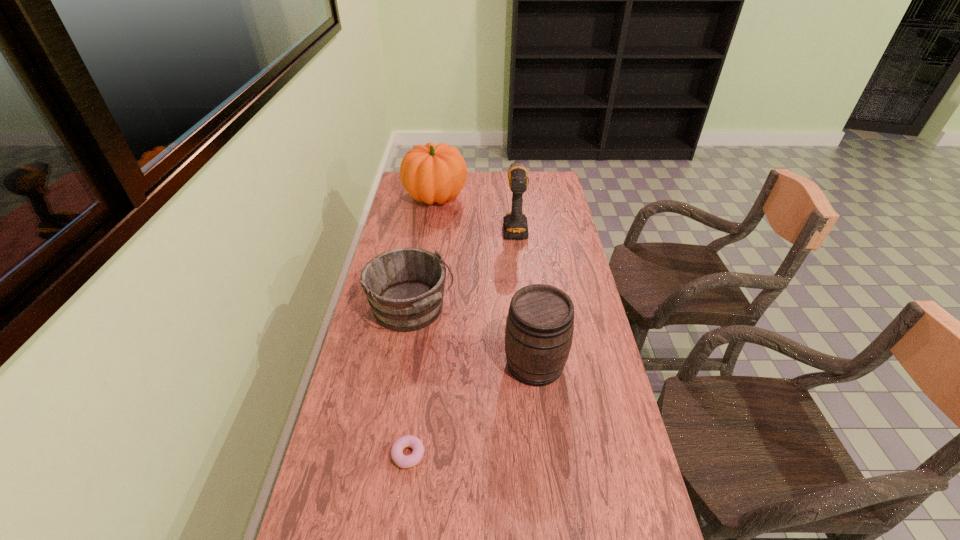
Find the location of a particular element. The width and height of the screenshot is (960, 540). drill is located at coordinates (515, 225).

Locate an element on the screen. pumpkin is located at coordinates (432, 173).

Locate an element on the screen. The height and width of the screenshot is (540, 960). the right wine bucket is located at coordinates (539, 329).

This screenshot has width=960, height=540. Find the location of `the left wine bucket`. the left wine bucket is located at coordinates (405, 287).

This screenshot has width=960, height=540. I want to click on the shorter wine bucket, so point(405,287).

The height and width of the screenshot is (540, 960). I want to click on doughnut, so click(x=408, y=441).

I want to click on the nearest object, so click(408, 441).

Locate an element on the screen. This screenshot has width=960, height=540. vacant space situated 0.310m with the drill bit of the drill facing forward is located at coordinates pos(510,177).

Identify the location of free space located 0.060m with the drill bit of the drill facing forward. (513, 204).

Find the location of a particular element. This screenshot has width=960, height=540. free space located 0.280m with the drill bit of the drill facing forward is located at coordinates (510, 180).